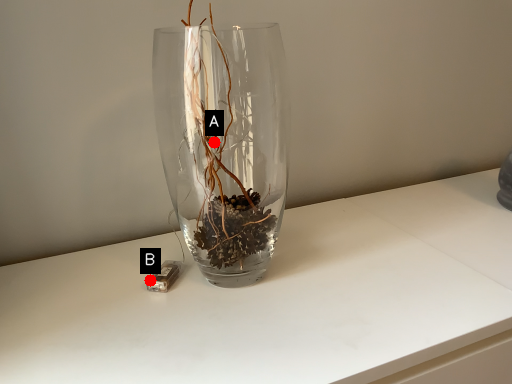
Question: Two points are circled on the image, labeled by A and B beside each circle. Among these points, which one is farthest from the camera?

Choices:
 (A) A is further
 (B) B is further

Answer: (B)